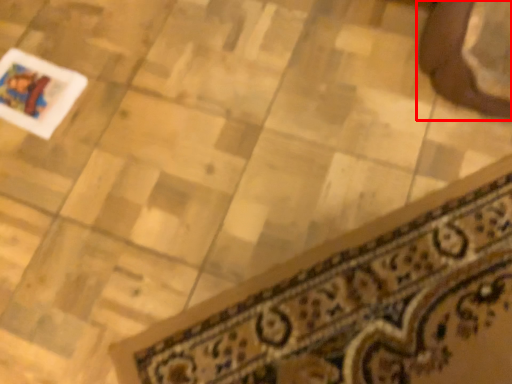
Question: From the image's perspective, considering the relative positions of footwear (annotated by the red box) and doormat in the image provided, where is footwear (annotated by the red box) located with respect to the staircase?

Choices:
 (A) above
 (B) below

Answer: (A)